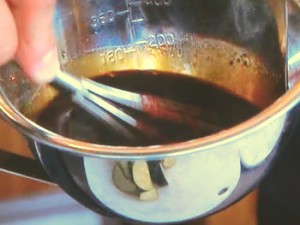
I want to click on bowl, so click(169, 163).